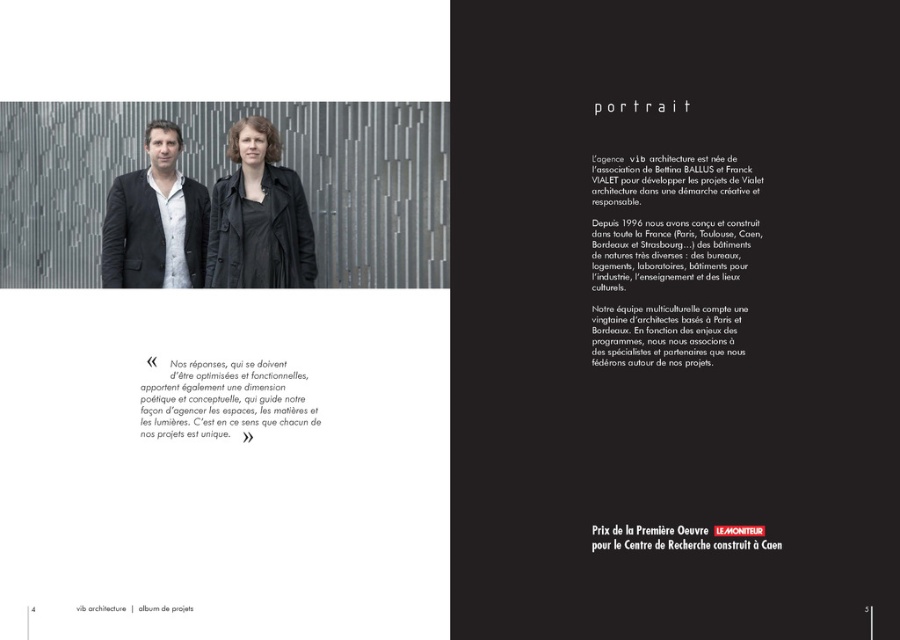
You are a photographer who needs to capture a closeup shot of both the black matte jacket at center and the black paper quote at center in the image. Given that your camera can only focus on objects within a 70 cm range, will you be able to capture both in a single shot?

The black matte jacket at center is 83.81 centimeters away from the black paper quote at center. Since the distance between them exceeds the camera focus range of 70 cm, you cannot capture both in a single shot.